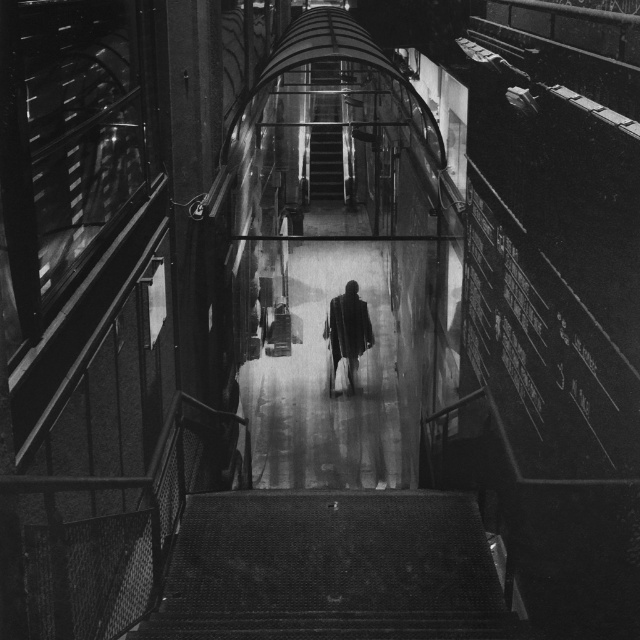
Question: Which is nearer to the metallic mesh stairs at bottom?

Choices:
 (A) metallic staircase at center
 (B) dark textured coat at center

Answer: (B)

Question: Is metallic staircase at center below dark textured coat at center?

Choices:
 (A) yes
 (B) no

Answer: (B)

Question: Which is nearer to the dark textured coat at center?

Choices:
 (A) metallic mesh stairs at bottom
 (B) metallic staircase at center

Answer: (B)

Question: Is metallic mesh stairs at bottom positioned at the back of metallic staircase at center?

Choices:
 (A) no
 (B) yes

Answer: (A)

Question: Which point is closer to the camera taking this photo?

Choices:
 (A) (333, 300)
 (B) (340, 163)

Answer: (A)

Question: Is metallic mesh stairs at bottom behind metallic staircase at center?

Choices:
 (A) no
 (B) yes

Answer: (A)